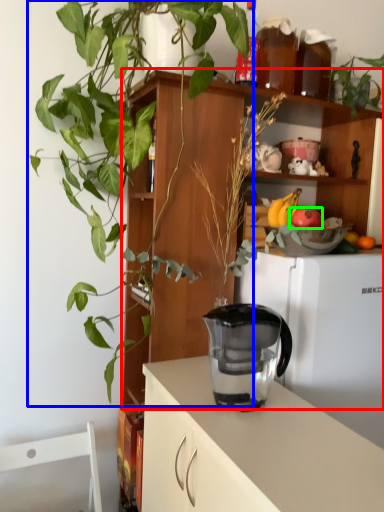
Question: Which is nearer to the shelf (highlighted by a red box)? houseplant (highlighted by a blue box) or apple (highlighted by a green box).

Choices:
 (A) houseplant
 (B) apple

Answer: (A)